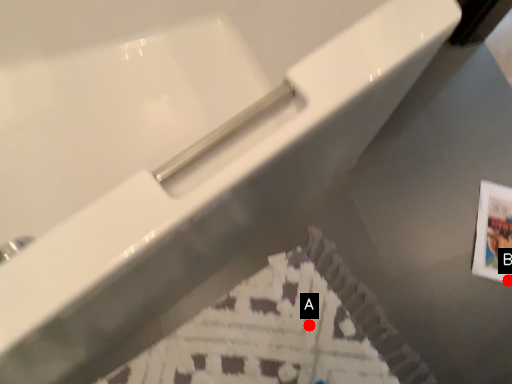
Question: Two points are circled on the image, labeled by A and B beside each circle. Among these points, which one is nearest to the camera?

Choices:
 (A) A is closer
 (B) B is closer

Answer: (A)